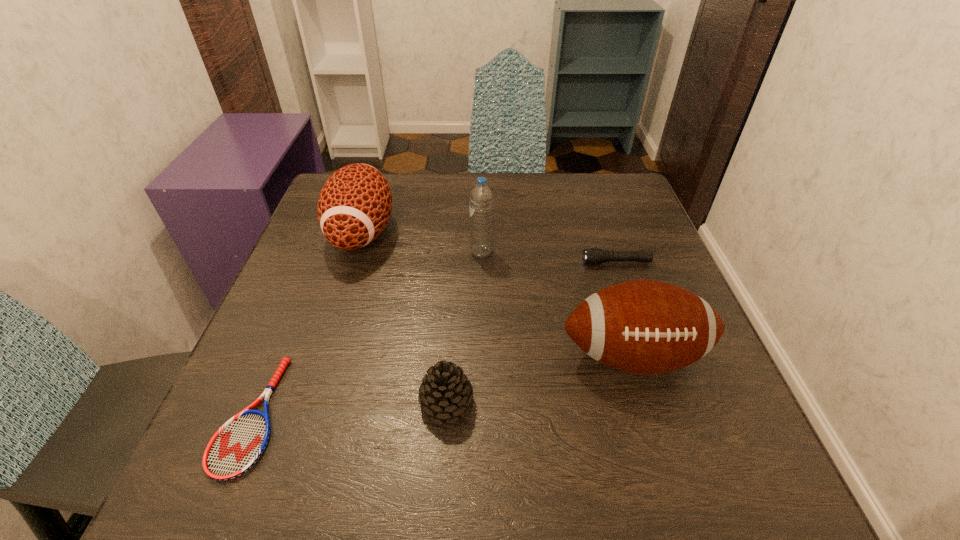
Image resolution: width=960 pixels, height=540 pixels. Find the location of `free space between the pinecone and the water bottle`. free space between the pinecone and the water bottle is located at coordinates (464, 327).

This screenshot has height=540, width=960. I want to click on empty space between the fourth tallest object and the flashlight, so click(532, 332).

The height and width of the screenshot is (540, 960). In order to click on empty space that is in between the fifth tallest object and the third shortest object in this screenshot , I will do `click(532, 332)`.

What are the coordinates of `vacant area that lies between the pinecone and the nearer football` in the screenshot? It's located at (540, 379).

Find the location of a particular element. This screenshot has width=960, height=540. free space that is in between the tennis racket and the pinecone is located at coordinates (349, 409).

Locate an element on the screen. object that is the second closest to the farther football is located at coordinates (238, 444).

This screenshot has height=540, width=960. What are the coordinates of `object identified as the fifth closest to the nearer football` in the screenshot? It's located at (238, 444).

Identify the location of free spot that satisfies the following two spatial constraints: 1. on the laces of the nearer football; 2. at the narrow end of the pinecone. (648, 402).

Where is `free point that satisfies the following two spatial constraints: 1. on the front side of the water bottle; 2. on the left side of the left football`? The image size is (960, 540). free point that satisfies the following two spatial constraints: 1. on the front side of the water bottle; 2. on the left side of the left football is located at coordinates (356, 253).

You are a GUI agent. You are given a task and a screenshot of the screen. Output one action in this format:
    pyautogui.click(x=<x>, y=<y>)
    Task: Click on the blank space that satisfies the following two spatial constraints: 1. at the lens end of the second shortest object; 2. on the laces of the right football
    
    Given the screenshot: What is the action you would take?
    pyautogui.click(x=648, y=356)